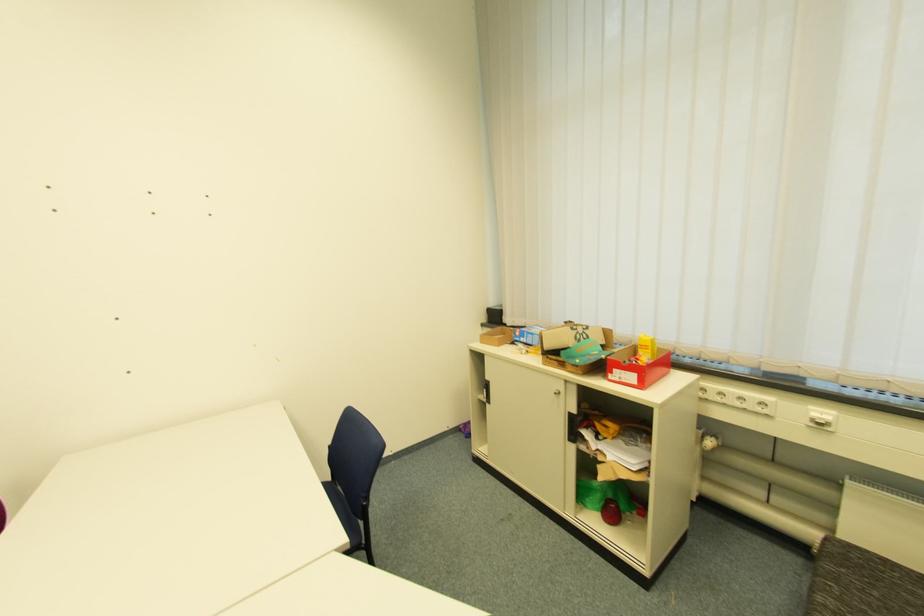
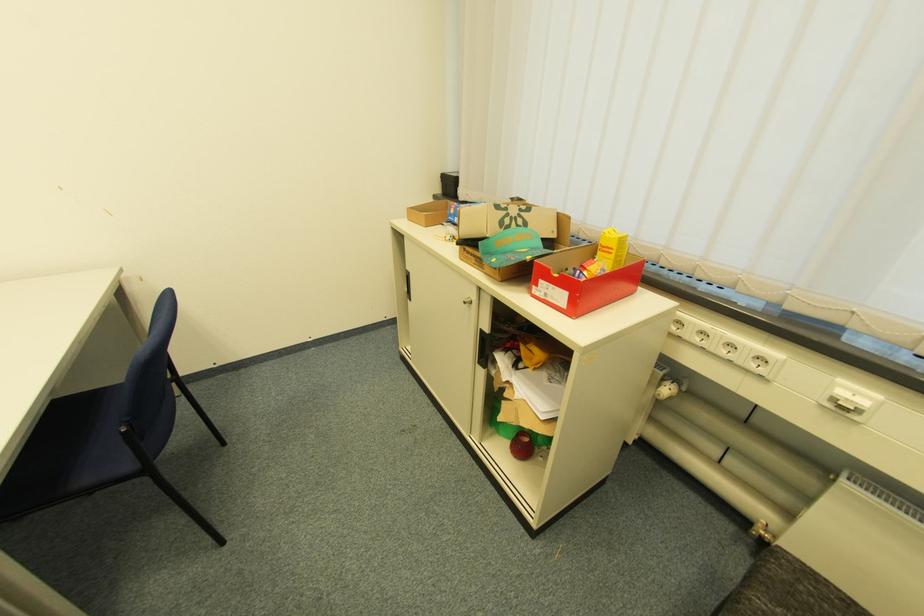
Question: The images are taken continuously from a first-person perspective. In which direction is your viewpoint rotating?

Choices:
 (A) Left
 (B) Right
 (C) Up
 (D) Down

Answer: (D)